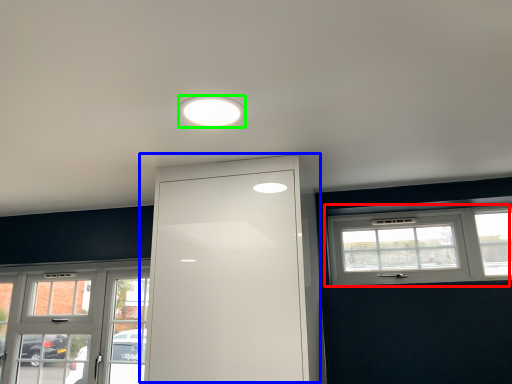
Question: Considering the real-world distances, which object is closest to window (highlighted by a red box)? door (highlighted by a blue box) or lighting (highlighted by a green box).

Choices:
 (A) door
 (B) lighting

Answer: (A)